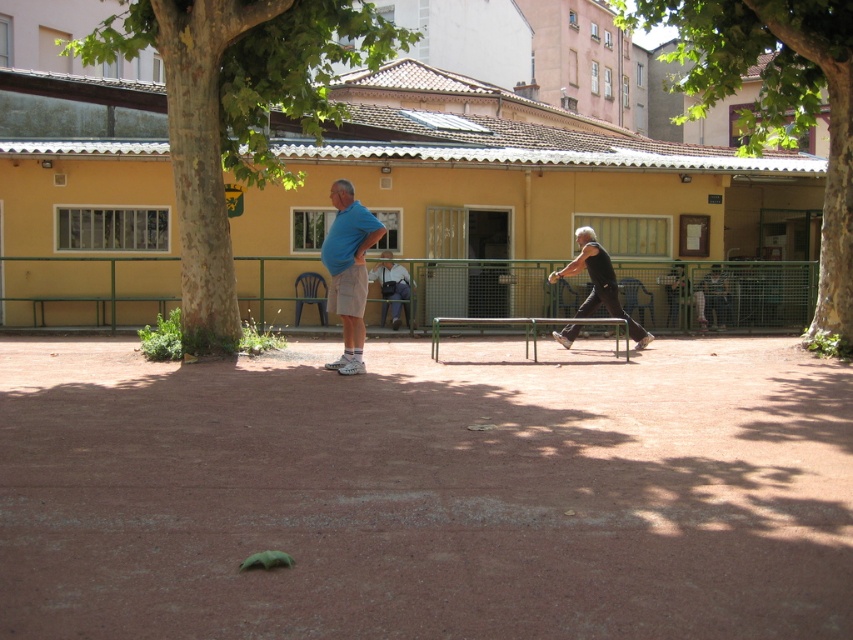
Question: Can you confirm if green rough bark tree at left is smaller than black sleeveless shirt at right?

Choices:
 (A) yes
 (B) no

Answer: (B)

Question: Which point is closer to the camera taking this photo?

Choices:
 (A) coord(190,301)
 (B) coord(370,275)

Answer: (A)

Question: Which of these objects is positioned farthest from the green rough bark tree at left?

Choices:
 (A) black sleeveless shirt at right
 (B) matte blue shirt at center

Answer: (A)

Question: Can you confirm if green leafy tree at center is positioned to the right of black sleeveless shirt at right?

Choices:
 (A) yes
 (B) no

Answer: (A)

Question: Which point is closer to the camera?

Choices:
 (A) (218, 38)
 (B) (677, 285)
 (C) (573, 314)
 (D) (840, 128)

Answer: (A)

Question: Is green rough bark tree at left positioned at the back of matte blue shirt at center?

Choices:
 (A) yes
 (B) no

Answer: (A)